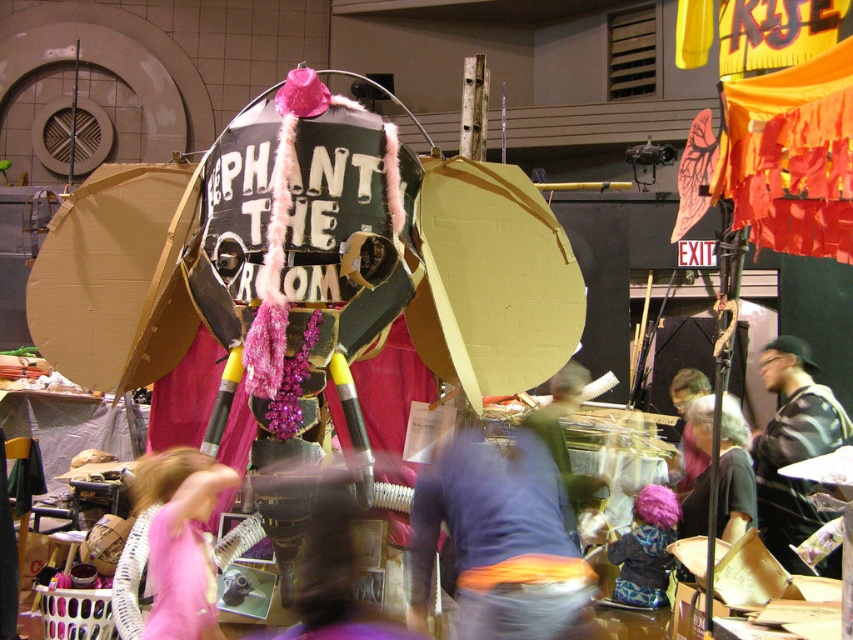
Question: Which of the following is the closest to the observer?

Choices:
 (A) (682, 461)
 (B) (639, 516)
 (C) (685, 499)

Answer: (B)

Question: Which point appears farthest from the camera in this image?

Choices:
 (A) (466, 532)
 (B) (695, 429)

Answer: (B)

Question: Can you confirm if pink fabric dress at center is positioned to the right of striped jersey at center?

Choices:
 (A) yes
 (B) no

Answer: (B)

Question: Is pink fabric dress at center wider than striped jersey at center?

Choices:
 (A) no
 (B) yes

Answer: (A)

Question: Can you confirm if orange fabric belt at center is thinner than plush pink wig at center?

Choices:
 (A) no
 (B) yes

Answer: (A)

Question: Which point is closer to the camera taking this photo?

Choices:
 (A) (485, 531)
 (B) (744, 525)
 (C) (229, 477)

Answer: (A)